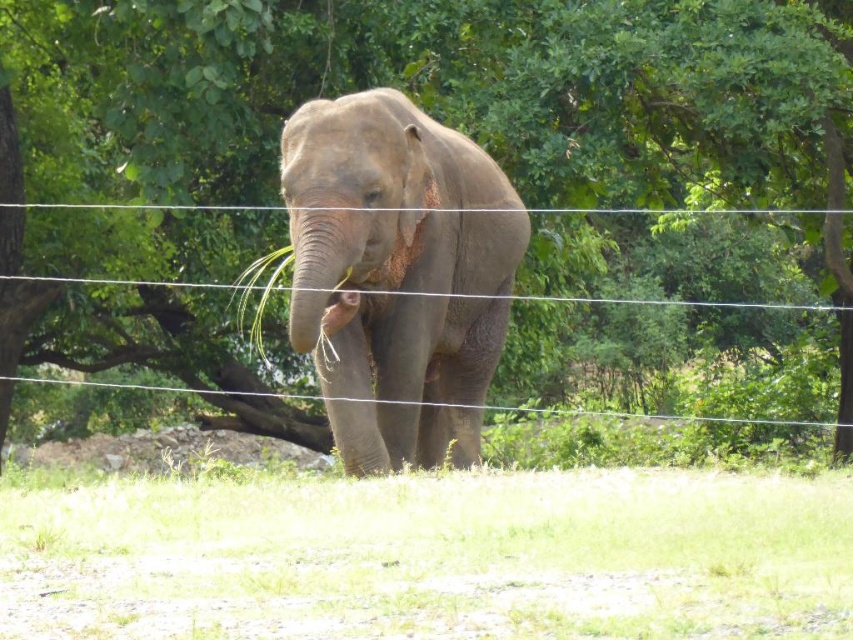
You are a zookeeper standing at point A, which is located at point (544, 1). You need to walk to point B at (286, 131) to check on an elephant. Which direction should you walk to reach point B from point A?

Since point A is behind point B, you should walk forward to reach point B from point A.

You are standing in front of an elephant enclosure and want to take a photo. There are two points marked on the ground where you can place your tripod. The first point is at coordinate point (108, 608), and the second is at coordinate point (416, 160). Which point is closer to you?

Point (108, 608) is closer to the viewer than point (416, 160).

You are a small animal trying to hide from predators. You see the green grass at lower center and the gray matte elephant at center. Which location would provide better concealment?

The green grass at lower center would provide better concealment because it is smaller in size compared to the gray matte elephant at center, making it easier to hide among the grass.